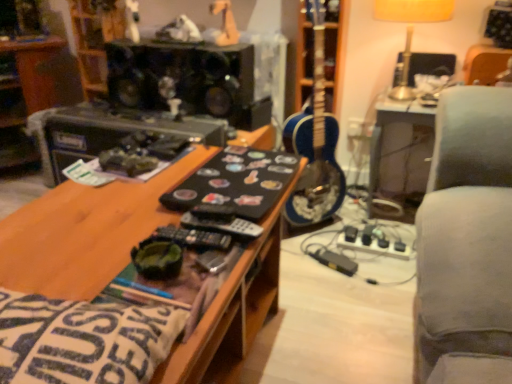
The height and width of the screenshot is (384, 512). What are the coordinates of `free region under matte gold table lamp at upper right (from a real-world perspective)` in the screenshot? It's located at (411, 97).